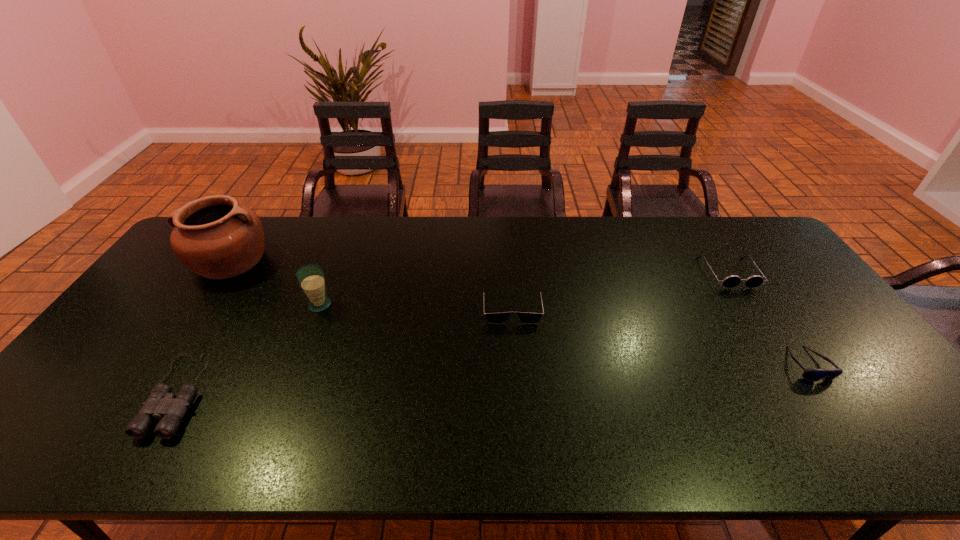
Where is `pottery`? pottery is located at coordinates (214, 236).

Where is `the fourth object from right to left`? The image size is (960, 540). the fourth object from right to left is located at coordinates (311, 278).

Where is `the fifth shortest object`? Image resolution: width=960 pixels, height=540 pixels. the fifth shortest object is located at coordinates (311, 278).

This screenshot has height=540, width=960. I want to click on the nearest sunglasses, so click(x=812, y=374).

The width and height of the screenshot is (960, 540). Find the location of `the third object from right to left`. the third object from right to left is located at coordinates (492, 318).

Image resolution: width=960 pixels, height=540 pixels. I want to click on binoculars, so click(160, 404).

At what (x,y) coordinates should I click in order to perform the action: click on free location located on the front of the pottery. Please return your answer as a coordinate pair (x, y). Looking at the image, I should click on (185, 329).

Identify the location of vacant space situated on the front of the fifth shortest object. (296, 367).

Where is `free space located 0.150m on the front-facing side of the nearest sunglasses`? Image resolution: width=960 pixels, height=540 pixels. free space located 0.150m on the front-facing side of the nearest sunglasses is located at coordinates (861, 441).

The width and height of the screenshot is (960, 540). What are the coordinates of `free space located 0.160m on the front-facing side of the fourth object from left to right` in the screenshot? It's located at (516, 370).